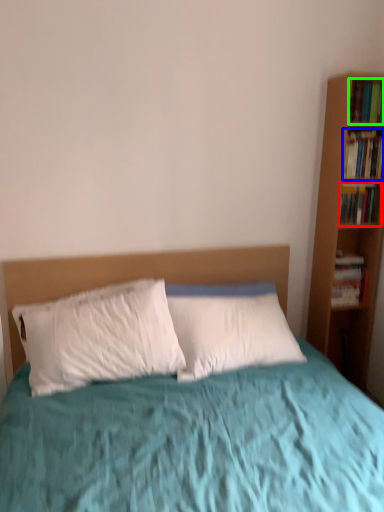
Question: Which is farther away from book (highlighted by a red box)? book (highlighted by a blue box) or book (highlighted by a green box)?

Choices:
 (A) book
 (B) book

Answer: (B)